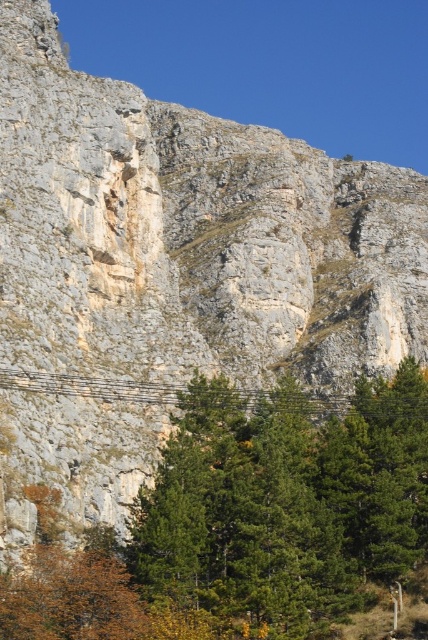
Question: From the image, what is the correct spatial relationship of green leafy tree at center in relation to metallic wire at center?

Choices:
 (A) left
 (B) right

Answer: (A)

Question: Is green leafy tree at center positioned before metallic wire at center?

Choices:
 (A) yes
 (B) no

Answer: (A)

Question: In this image, where is green leafy tree at center located relative to metallic wire at center?

Choices:
 (A) above
 (B) below

Answer: (B)

Question: Which point is closer to the camera taking this photo?

Choices:
 (A) (291, 515)
 (B) (395, 412)

Answer: (A)

Question: Which point appears farthest from the camera in this image?

Choices:
 (A) (47, 522)
 (B) (394, 412)

Answer: (B)